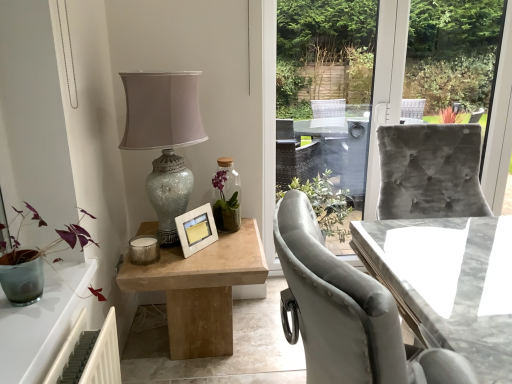
Find the location of a particular element. This screenshot has width=512, height=384. vacant region in front of white matte picture frame at center is located at coordinates (191, 264).